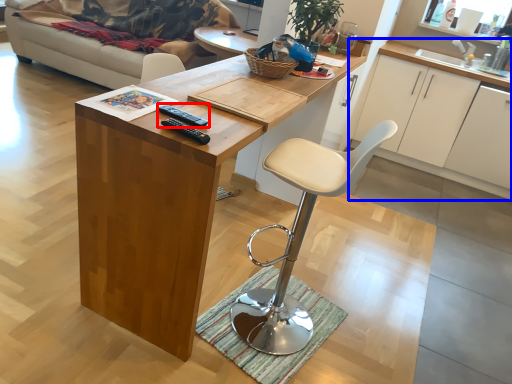
Question: Which object appears closest to the camera in this image, remote (highlighted by a red box) or cabinetry (highlighted by a blue box)?

Choices:
 (A) remote
 (B) cabinetry

Answer: (A)